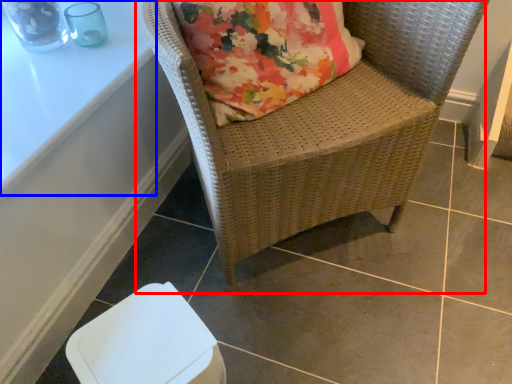
Question: Among these objects, which one is nearest to the camera, chair (highlighted by a red box) or table (highlighted by a blue box)?

Choices:
 (A) chair
 (B) table

Answer: (A)